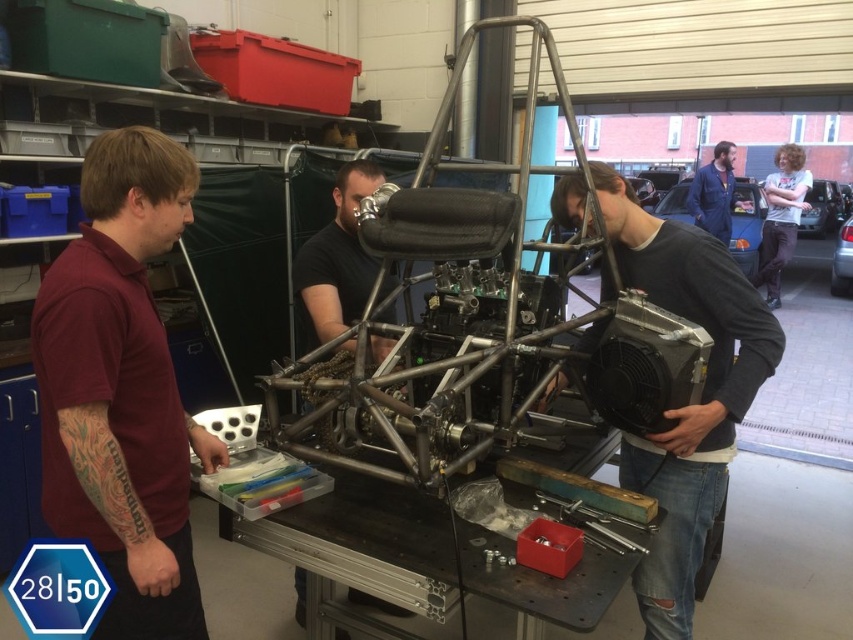
Question: Which object is closer to the camera taking this photo?

Choices:
 (A) matte black radiator at center
 (B) blue denim jacket at upper right
 (C) black matte helmet at center

Answer: (A)

Question: Is blue denim jacket at upper right positioned in front of metallic red toolbox at center?

Choices:
 (A) no
 (B) yes

Answer: (A)

Question: Can you confirm if blue denim jacket at upper right is bigger than metallic red toolbox at center?

Choices:
 (A) yes
 (B) no

Answer: (A)

Question: Based on their relative distances, which object is farther from the black matte helmet at center?

Choices:
 (A) metallic red toolbox at center
 (B) matte black radiator at center

Answer: (A)

Question: Based on their relative distances, which object is farther from the maroon shirt at left?

Choices:
 (A) blue denim jacket at upper right
 (B) metallic red toolbox at center
 (C) matte black radiator at center
 (D) black matte helmet at center

Answer: (A)

Question: Is the position of maroon shirt at left less distant than that of matte black radiator at center?

Choices:
 (A) no
 (B) yes

Answer: (B)